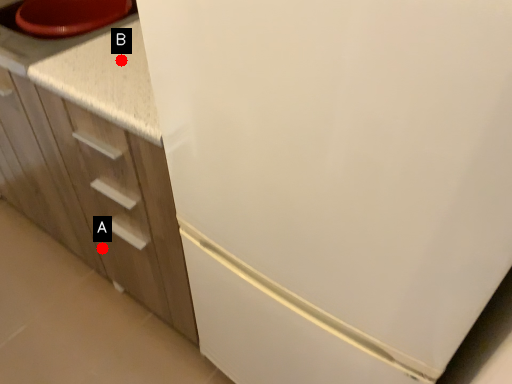
Question: Two points are circled on the image, labeled by A and B beside each circle. Among these points, which one is farthest from the camera?

Choices:
 (A) A is further
 (B) B is further

Answer: (A)